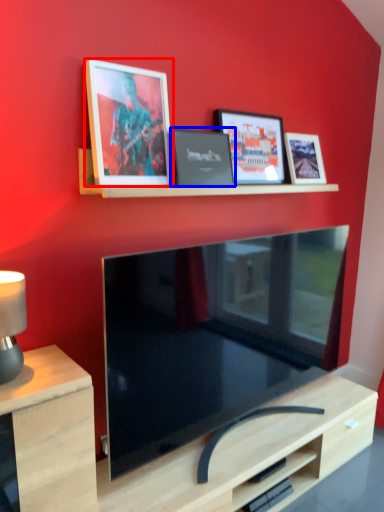
Question: Which object is further to the camera taking this photo, picture frame (highlighted by a red box) or picture frame (highlighted by a blue box)?

Choices:
 (A) picture frame
 (B) picture frame

Answer: (B)